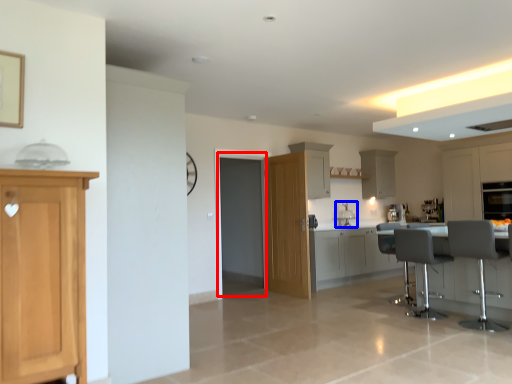
Question: Which object is closer to the camera taking this photo, glass door (highlighted by a red box) or sink (highlighted by a blue box)?

Choices:
 (A) glass door
 (B) sink

Answer: (A)